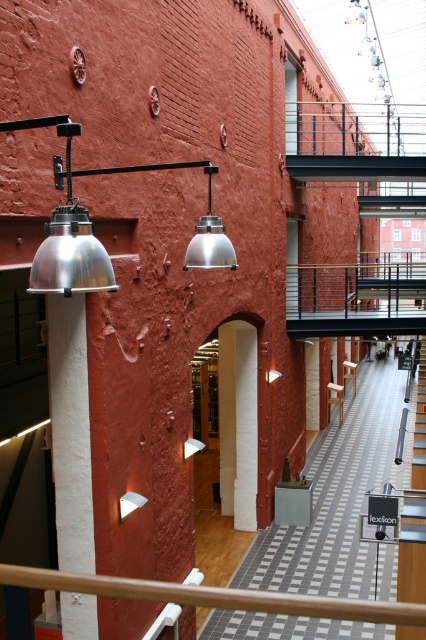
Image resolution: width=426 pixels, height=640 pixels. I want to click on silver metallic lamp at center, so [x=210, y=237].

Does silver metallic lamp at center have a greater width compared to light brown wooden stool at center?

No.

Which is behind, point (232, 266) or point (333, 396)?

Point (333, 396)

At what (x,y) coordinates should I click in order to perform the action: click on silver metallic lamp at center. Please return your answer as a coordinate pair (x, y). The width and height of the screenshot is (426, 640). Looking at the image, I should click on (210, 237).

Can you confirm if white matte pillar at center is positioned to the right of metallic staircase at center?

No, white matte pillar at center is not to the right of metallic staircase at center.

Between white matte pillar at center and metallic staircase at center, which one appears on the right side from the viewer's perspective?

metallic staircase at center is more to the right.

Who is more distant from viewer, [255,509] or [423,413]?

The point [423,413] is more distant.

Locate an element on the screen. The image size is (426, 640). white matte pillar at center is located at coordinates (245, 426).

Can you confirm if white painted concrete pillar at left is smaller than white matte pillar at center?

Actually, white painted concrete pillar at left might be larger than white matte pillar at center.

Which is more to the right, white painted concrete pillar at left or white matte pillar at center?

white matte pillar at center

What do you see at coordinates (71, 432) in the screenshot? This screenshot has width=426, height=640. I see `white painted concrete pillar at left` at bounding box center [71, 432].

Locate an element on the screen. Image resolution: width=426 pixels, height=640 pixels. white painted concrete pillar at left is located at coordinates (71, 432).